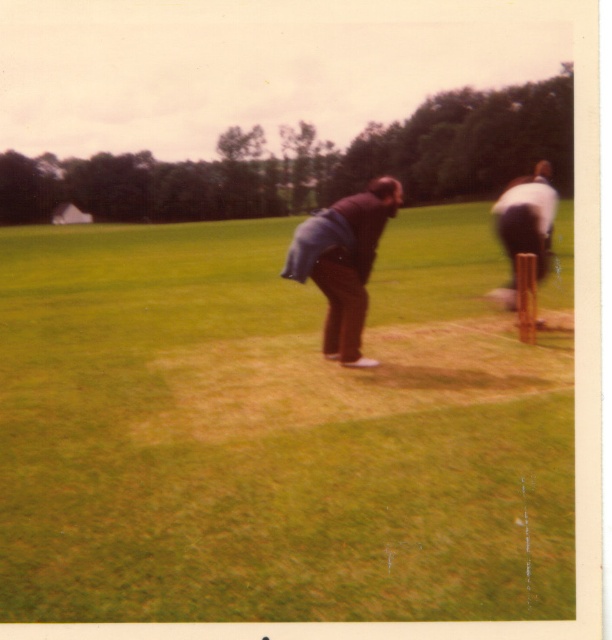
Between green grass at center and white fabric shirt at right, which one has less height?

Standing shorter between the two is green grass at center.

Is the position of green grass at center more distant than that of white fabric shirt at right?

No, it is in front of white fabric shirt at right.

Is point (528, 461) more distant than point (529, 241)?

No, it is not.

The height and width of the screenshot is (640, 612). I want to click on green grass at center, so (275, 433).

Which is below, green grass at center or blue denim jacket at center?

blue denim jacket at center is lower down.

Looking at this image, can you confirm if green grass at center is positioned to the right of blue denim jacket at center?

Indeed, green grass at center is positioned on the right side of blue denim jacket at center.

Between point (198, 570) and point (337, 332), which one is positioned behind?

Point (337, 332)

I want to click on green grass at center, so tap(275, 433).

Looking at this image, is blue denim jacket at center wider than white fabric shirt at right?

In fact, blue denim jacket at center might be narrower than white fabric shirt at right.

Is blue denim jacket at center shorter than white fabric shirt at right?

Yes, blue denim jacket at center is shorter than white fabric shirt at right.

Between point (353, 316) and point (550, 220), which one is positioned in front?

Positioned in front is point (353, 316).

I want to click on blue denim jacket at center, so click(343, 262).